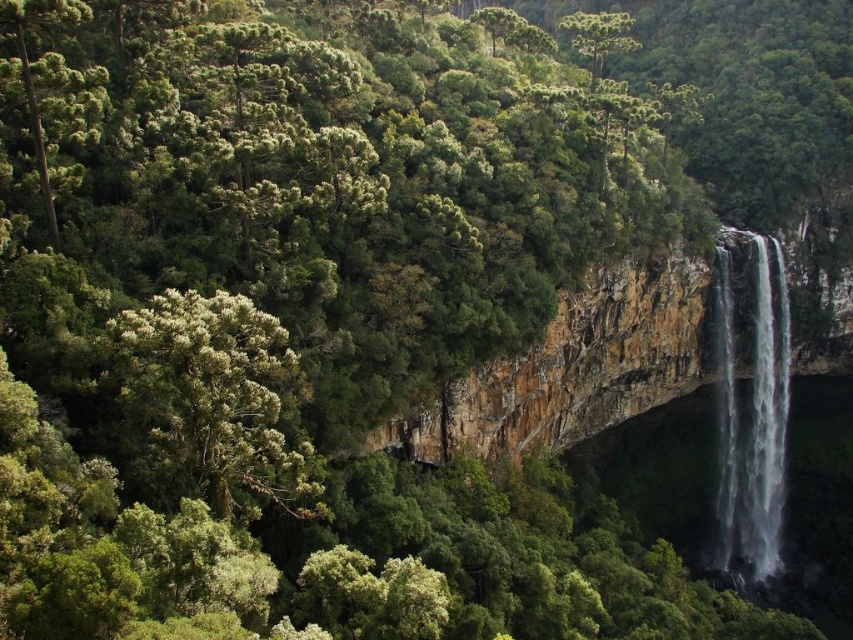
Question: Observing the image, what is the correct spatial positioning of green leafy tree at left in reference to clear water at right?

Choices:
 (A) right
 (B) left

Answer: (B)

Question: Among these points, which one is farthest from the camera?

Choices:
 (A) (157, 321)
 (B) (762, 426)

Answer: (B)

Question: Which point appears closest to the camera in this image?

Choices:
 (A) (779, 336)
 (B) (126, 396)

Answer: (B)

Question: Does green leafy tree at left lie in front of clear water at right?

Choices:
 (A) yes
 (B) no

Answer: (A)

Question: Is green leafy tree at left positioned at the back of clear water at right?

Choices:
 (A) no
 (B) yes

Answer: (A)